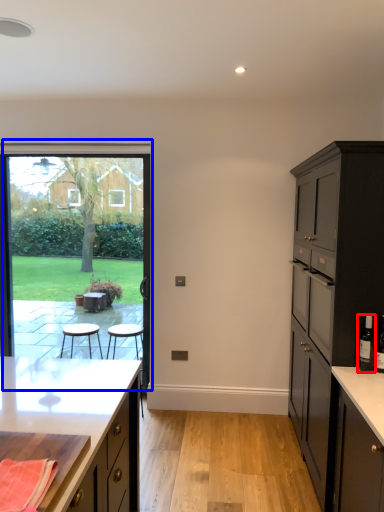
Question: Which point is further to the camera, bottle (highlighted by a red box) or window (highlighted by a blue box)?

Choices:
 (A) bottle
 (B) window

Answer: (B)